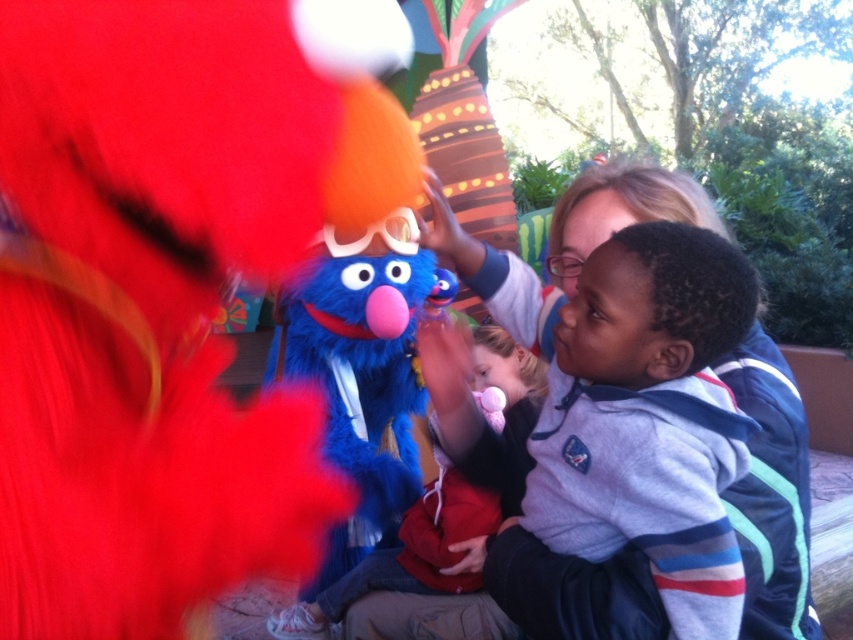
Question: Does smooth blond hair at upper center appear over fuzzy blue puppet at center?

Choices:
 (A) no
 (B) yes

Answer: (B)

Question: Which point appears closest to the camera in this image?

Choices:
 (A) (412, 588)
 (B) (660, 376)

Answer: (B)

Question: Which point is farther from the camera taking this photo?

Choices:
 (A) (492, 403)
 (B) (395, 212)
 (C) (688, 392)

Answer: (B)

Question: Does smooth blond hair at upper center appear over fluffy blue costume at center?

Choices:
 (A) no
 (B) yes

Answer: (B)

Question: Can you confirm if smooth blond hair at upper center is smaller than fuzzy blue puppet at center?

Choices:
 (A) no
 (B) yes

Answer: (B)

Question: Which of the following is the closest to the observer?

Choices:
 (A) (274, 317)
 (B) (424, 524)

Answer: (B)